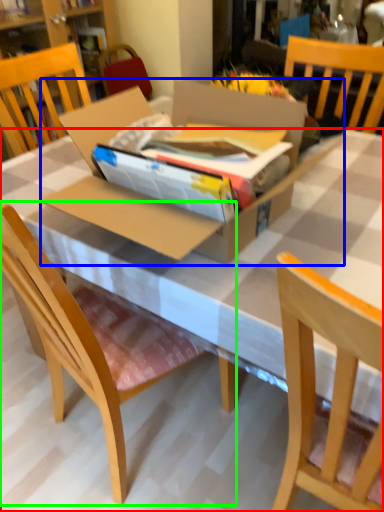
Question: Which object is positioned farthest from desk (highlighted by a red box)? Select from cardboard box (highlighted by a blue box) and chair (highlighted by a green box).

Choices:
 (A) cardboard box
 (B) chair

Answer: (B)